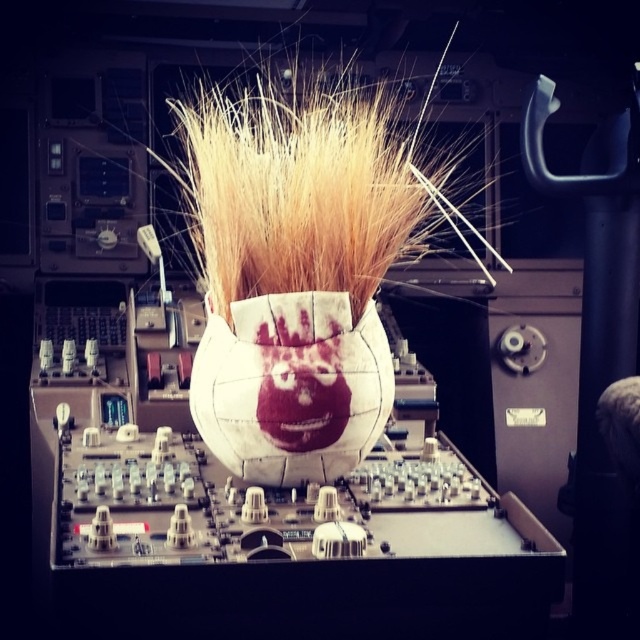
You are an astronaut in the spacecraft cockpit. You see a spherical object with a face and red splatters. There is a point marked at coordinates (307, 184). What does this point indicate?

The point at coordinates (307, 184) marks the location of the golden straw hair at the center of the spherical object.

You are an astronaut in the spacecraft cockpit. You need to place a small plant in a spot where it won not block the controls. The white fabric vase at center is already there. Can the golden straw hair at center be moved to make space?

The golden straw hair at center is much taller than the white fabric vase at center, so moving it might be difficult due to its height and structure. However, since the white fabric vase is already placed, the golden straw hair might be blocking controls. To make space, consider relocating the shorter white fabric vase instead.